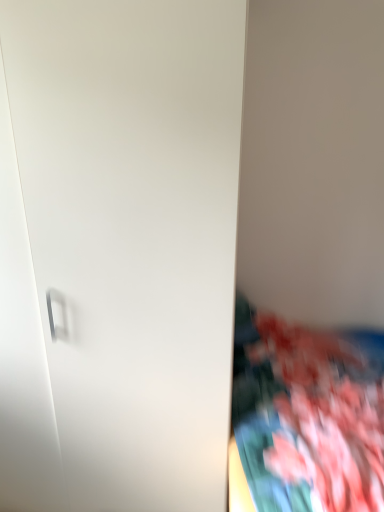
Question: From a real-world perspective, is floral fabric at right physically below white matte door at center?

Choices:
 (A) yes
 (B) no

Answer: (A)

Question: From a real-world perspective, is floral fabric at right on top of white matte door at center?

Choices:
 (A) yes
 (B) no

Answer: (B)

Question: Is the position of floral fabric at right more distant than that of white matte door at center?

Choices:
 (A) yes
 (B) no

Answer: (B)

Question: Can you confirm if floral fabric at right is bigger than white matte door at center?

Choices:
 (A) no
 (B) yes

Answer: (A)

Question: Are floral fabric at right and white matte door at center far apart?

Choices:
 (A) no
 (B) yes

Answer: (A)

Question: Is floral fabric at right turned away from white matte door at center?

Choices:
 (A) yes
 (B) no

Answer: (B)

Question: Can you confirm if white matte door at center is taller than floral fabric at right?

Choices:
 (A) no
 (B) yes

Answer: (B)

Question: Is the position of white matte door at center less distant than that of floral fabric at right?

Choices:
 (A) yes
 (B) no

Answer: (B)

Question: Is white matte door at center not within floral fabric at right?

Choices:
 (A) no
 (B) yes

Answer: (B)

Question: Does white matte door at center have a greater width compared to floral fabric at right?

Choices:
 (A) no
 (B) yes

Answer: (A)

Question: Can you confirm if white matte door at center is thinner than floral fabric at right?

Choices:
 (A) no
 (B) yes

Answer: (B)

Question: From a real-world perspective, does white matte door at center stand above floral fabric at right?

Choices:
 (A) yes
 (B) no

Answer: (A)

Question: Looking at the image, does floral fabric at right seem bigger or smaller compared to white matte door at center?

Choices:
 (A) big
 (B) small

Answer: (B)